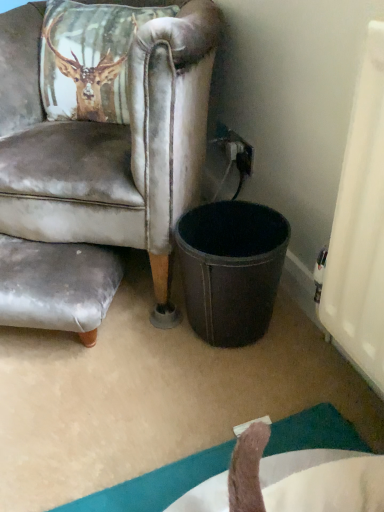
Question: From the image's perspective, is leather at right on gray fabric swivel chair at lower left?

Choices:
 (A) no
 (B) yes

Answer: (B)

Question: Can you confirm if leather at right is shorter than gray fabric swivel chair at lower left?

Choices:
 (A) no
 (B) yes

Answer: (A)

Question: Is leather at right not within gray fabric swivel chair at lower left?

Choices:
 (A) yes
 (B) no

Answer: (A)

Question: Considering the relative sizes of leather at right and gray fabric swivel chair at lower left in the image provided, is leather at right wider than gray fabric swivel chair at lower left?

Choices:
 (A) no
 (B) yes

Answer: (B)

Question: Is gray fabric swivel chair at lower left located within leather at right?

Choices:
 (A) yes
 (B) no

Answer: (A)

Question: Is black plastic power outlet at upper right wider or thinner than leather at right?

Choices:
 (A) wide
 (B) thin

Answer: (B)

Question: In the image, is black plastic power outlet at upper right positioned in front of or behind leather at right?

Choices:
 (A) front
 (B) behind

Answer: (B)

Question: Is black plastic power outlet at upper right bigger or smaller than leather at right?

Choices:
 (A) small
 (B) big

Answer: (A)

Question: Considering the relative positions of black plastic power outlet at upper right and leather at right in the image provided, is black plastic power outlet at upper right to the left or to the right of leather at right?

Choices:
 (A) left
 (B) right

Answer: (B)

Question: From their relative heights in the image, would you say black leather trash bin/can at lower center is taller or shorter than leather at right?

Choices:
 (A) short
 (B) tall

Answer: (A)

Question: In terms of size, does black leather trash bin/can at lower center appear bigger or smaller than leather at right?

Choices:
 (A) big
 (B) small

Answer: (B)

Question: In terms of width, does black leather trash bin/can at lower center look wider or thinner when compared to leather at right?

Choices:
 (A) wide
 (B) thin

Answer: (B)

Question: Is black leather trash bin/can at lower center to the left or to the right of leather at right in the image?

Choices:
 (A) left
 (B) right

Answer: (B)

Question: Is black leather trash bin/can at lower center in front of or behind black plastic power outlet at upper right in the image?

Choices:
 (A) behind
 (B) front

Answer: (B)

Question: Considering the positions of black leather trash bin/can at lower center and black plastic power outlet at upper right in the image, is black leather trash bin/can at lower center wider or thinner than black plastic power outlet at upper right?

Choices:
 (A) wide
 (B) thin

Answer: (A)